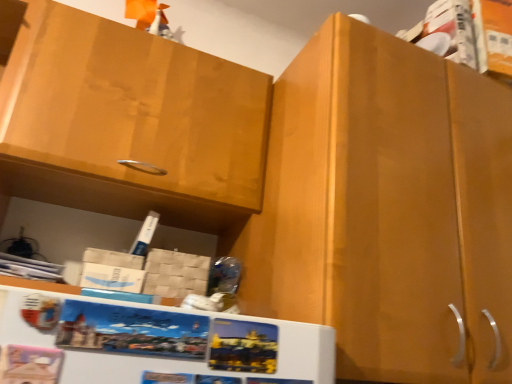
Question: Considering the relative sizes of matte wood cabinet at center, which ranks as the 1th cabinetry in right-to-left order, and matte wood cabinet at upper left, marked as the second cabinetry in a right-to-left arrangement, in the image provided, is matte wood cabinet at center, which ranks as the 1th cabinetry in right-to-left order, smaller than matte wood cabinet at upper left, marked as the second cabinetry in a right-to-left arrangement,?

Choices:
 (A) yes
 (B) no

Answer: (B)

Question: From a real-world perspective, does matte wood cabinet at center, which appears as the 2th cabinetry when viewed from the left, stand above matte wood cabinet at upper left, marked as the 1th cabinetry in a left-to-right arrangement?

Choices:
 (A) no
 (B) yes

Answer: (A)

Question: Is matte wood cabinet at center, which appears as the 2th cabinetry when viewed from the left, wider than matte wood cabinet at upper left, marked as the second cabinetry in a right-to-left arrangement?

Choices:
 (A) yes
 (B) no

Answer: (A)

Question: Does matte wood cabinet at center, which ranks as the 1th cabinetry in right-to-left order, appear on the left side of matte wood cabinet at upper left, marked as the 1th cabinetry in a left-to-right arrangement?

Choices:
 (A) no
 (B) yes

Answer: (A)

Question: From a real-world perspective, is matte wood cabinet at center, which ranks as the 1th cabinetry in right-to-left order, physically below matte wood cabinet at upper left, marked as the 1th cabinetry in a left-to-right arrangement?

Choices:
 (A) yes
 (B) no

Answer: (A)

Question: Considering the relative sizes of matte wood cabinet at center, which appears as the 2th cabinetry when viewed from the left, and matte wood cabinet at upper left, marked as the 1th cabinetry in a left-to-right arrangement, in the image provided, is matte wood cabinet at center, which appears as the 2th cabinetry when viewed from the left, thinner than matte wood cabinet at upper left, marked as the 1th cabinetry in a left-to-right arrangement,?

Choices:
 (A) no
 (B) yes

Answer: (A)

Question: Is matte wood cabinet at upper left, marked as the 1th cabinetry in a left-to-right arrangement, touching matte wood cabinet at center, which appears as the 2th cabinetry when viewed from the left?

Choices:
 (A) no
 (B) yes

Answer: (A)

Question: Is matte wood cabinet at upper left, marked as the 1th cabinetry in a left-to-right arrangement, positioned far away from matte wood cabinet at center, which ranks as the 1th cabinetry in right-to-left order?

Choices:
 (A) yes
 (B) no

Answer: (B)

Question: From a real-world perspective, does matte wood cabinet at upper left, marked as the second cabinetry in a right-to-left arrangement, stand above matte wood cabinet at center, which appears as the 2th cabinetry when viewed from the left?

Choices:
 (A) yes
 (B) no

Answer: (A)

Question: Is matte wood cabinet at center, which ranks as the 1th cabinetry in right-to-left order, at the back of matte wood cabinet at upper left, marked as the 1th cabinetry in a left-to-right arrangement?

Choices:
 (A) yes
 (B) no

Answer: (B)

Question: Can you confirm if matte wood cabinet at upper left, marked as the second cabinetry in a right-to-left arrangement, is thinner than matte wood cabinet at center, which ranks as the 1th cabinetry in right-to-left order?

Choices:
 (A) no
 (B) yes

Answer: (B)

Question: From the image's perspective, is matte wood cabinet at upper left, marked as the second cabinetry in a right-to-left arrangement, over matte wood cabinet at center, which appears as the 2th cabinetry when viewed from the left?

Choices:
 (A) yes
 (B) no

Answer: (A)

Question: From a real-world perspective, relative to matte wood cabinet at upper left, marked as the second cabinetry in a right-to-left arrangement, is matte wood cabinet at center, which appears as the 2th cabinetry when viewed from the left, vertically above or below?

Choices:
 (A) above
 (B) below

Answer: (B)